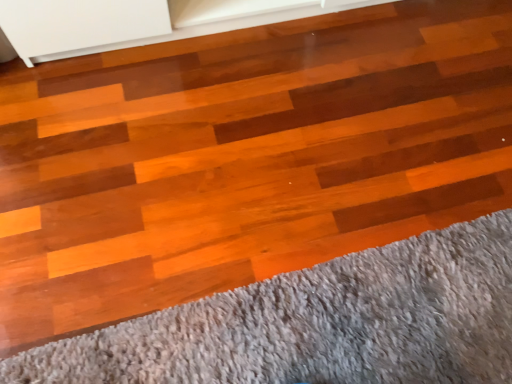
The width and height of the screenshot is (512, 384). Describe the element at coordinates (320, 323) in the screenshot. I see `gray shaggy rug at lower right` at that location.

Locate an element on the screen. This screenshot has height=384, width=512. gray shaggy rug at lower right is located at coordinates (320, 323).

Identify the location of gray shaggy rug at lower right. (320, 323).